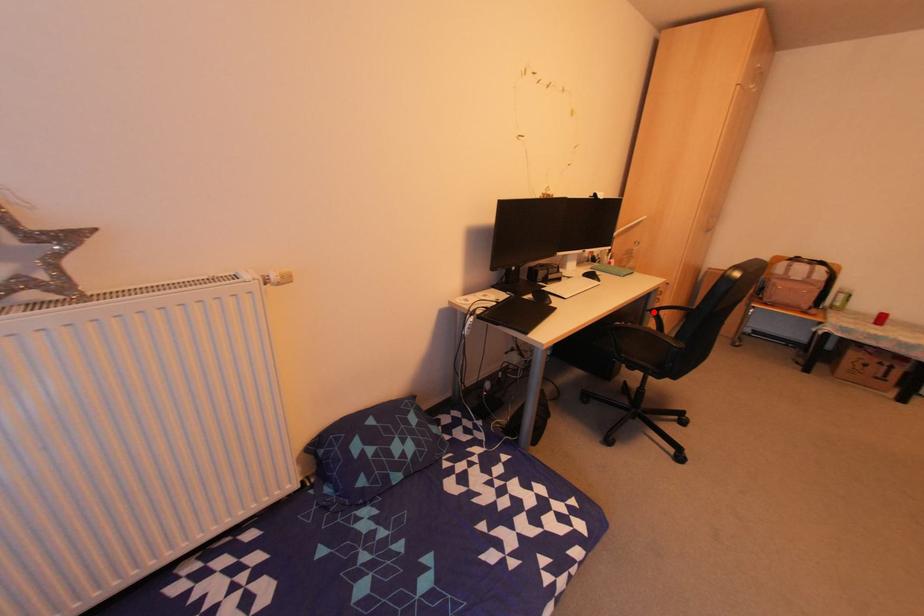
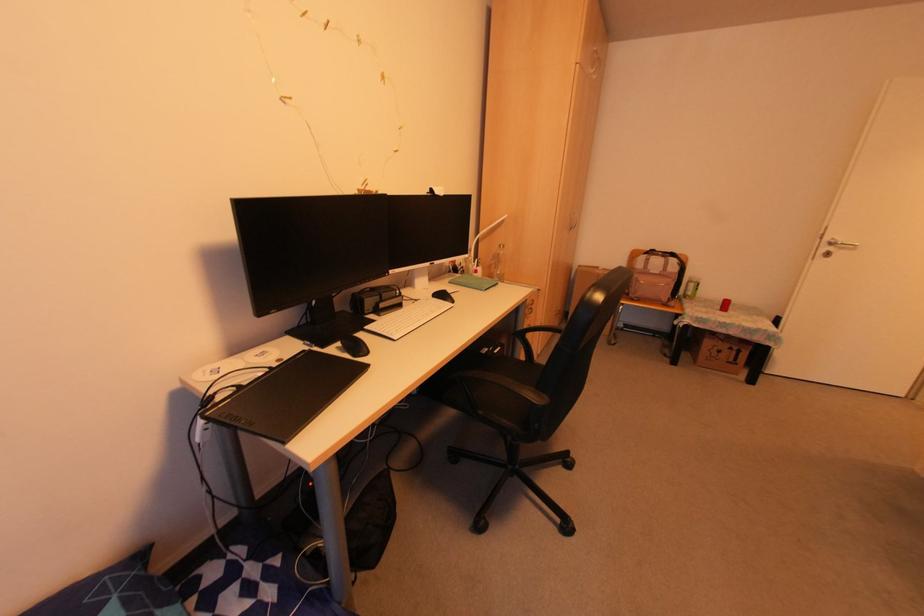
Where in the second image is the point corresponding to the highlighted location from the first image?

(518, 334)